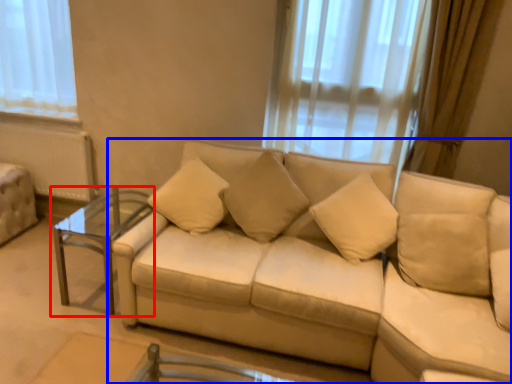
Question: Which of the following is the farthest to the observer, table (highlighted by a red box) or studio couch (highlighted by a blue box)?

Choices:
 (A) table
 (B) studio couch

Answer: (A)